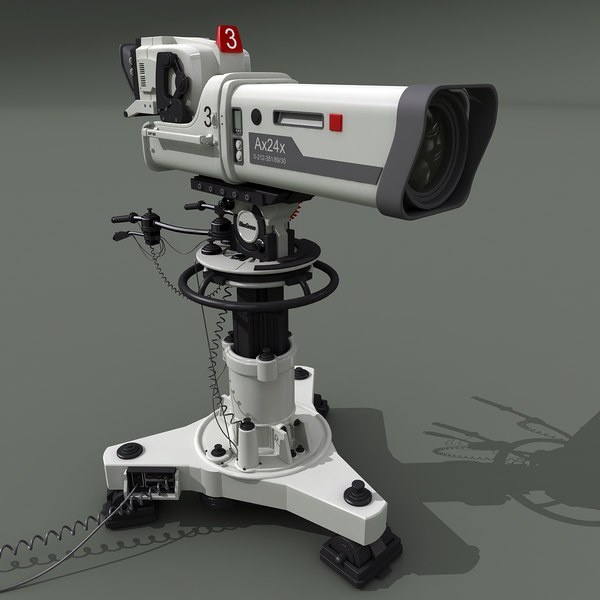
This screenshot has width=600, height=600. In order to click on stand in this screenshot , I will do `click(334, 479)`.